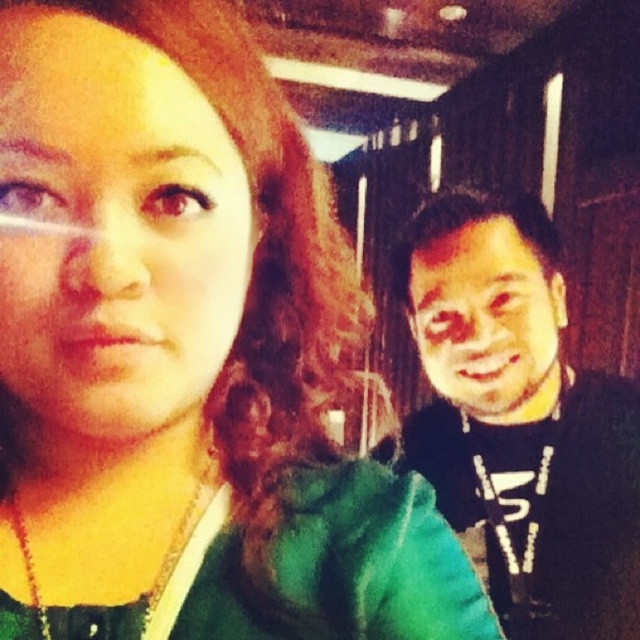
Does black matte shirt at right come in front of smooth skin face at right?

No.

How distant is black matte shirt at right from smooth skin face at right?

1.94 inches

You are a GUI agent. You are given a task and a screenshot of the screen. Output one action in this format:
    pyautogui.click(x=<x>, y=<y>)
    Task: Click on the black matte shirt at right
    This screenshot has width=640, height=640.
    Given the screenshot: What is the action you would take?
    pyautogui.click(x=518, y=419)

Which is in front, point (163, 104) or point (536, 595)?

Positioned in front is point (163, 104).

Is the position of matte green shirt at left less distant than that of black matte shirt at right?

Yes, matte green shirt at left is closer to the viewer.

Between point (0, 326) and point (531, 304), which one is positioned in front?

Positioned in front is point (0, 326).

The width and height of the screenshot is (640, 640). In order to click on matte green shirt at left in this screenshot , I will do `click(113, 228)`.

Between matte green shirt at left and smooth skin face at right, which one is positioned lower?

smooth skin face at right

Can you confirm if matte green shirt at left is smaller than smooth skin face at right?

Yes, matte green shirt at left is smaller than smooth skin face at right.

You are a GUI agent. You are given a task and a screenshot of the screen. Output one action in this format:
    pyautogui.click(x=<x>, y=<y>)
    Task: Click on the matte green shirt at left
    This screenshot has height=640, width=640.
    Given the screenshot: What is the action you would take?
    pyautogui.click(x=113, y=228)

Where is `matte green shirt at left`? The height and width of the screenshot is (640, 640). matte green shirt at left is located at coordinates (113, 228).